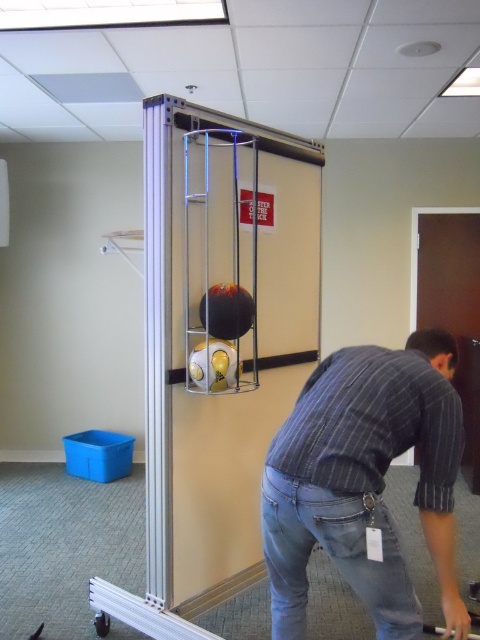
Question: Is blue denim jeans at lower center further to camera compared to shiny orange bowling ball at center?

Choices:
 (A) no
 (B) yes

Answer: (A)

Question: Which point is farther to the camera?

Choices:
 (A) blue denim jeans at lower center
 (B) shiny orange bowling ball at center

Answer: (B)

Question: Which point is farther from the camera taking this photo?

Choices:
 (A) (x=200, y=349)
 (B) (x=216, y=289)
 (C) (x=335, y=492)

Answer: (B)

Question: Which is farther from the shiny black bowling ball at center?

Choices:
 (A) shiny orange bowling ball at center
 (B) striped cotton shirt at lower right

Answer: (B)

Question: Is the position of striped cotton shirt at lower right less distant than that of shiny orange bowling ball at center?

Choices:
 (A) no
 (B) yes

Answer: (B)

Question: Does striped cotton shirt at lower right have a larger size compared to blue denim jeans at lower center?

Choices:
 (A) yes
 (B) no

Answer: (A)